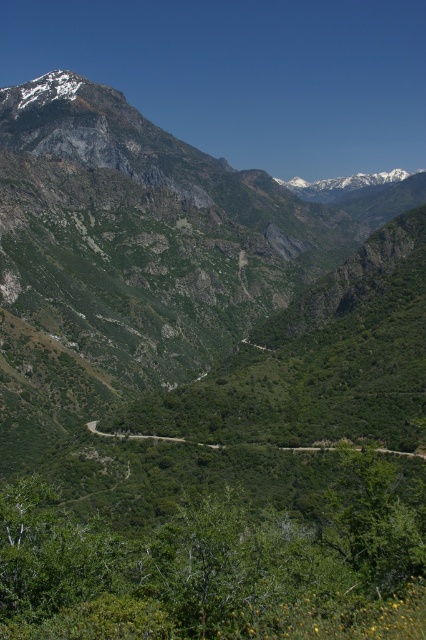
You are a hiker planning to take the green leafy road at center to reach the summit. Based on the image, will the green rocky mountain range at upper left block your path to the summit?

The green rocky mountain range at upper left is in front of the green leafy road at center, so it will block your path to the summit.

You are a hiker who wants to reach the green rocky mountain range at upper left from the green leafy road at center. Based on the provided information, what is the straight line distance you need to cover?

The straight line distance between the green rocky mountain range at upper left and the green leafy road at center is 124.31 meters.

You are a hiker planning to traverse the winding dirt road in the valley. You come across two points marked on your map at coordinates point (365, 310) and point (302, 445). Which point should you prioritize visiting first if you want to reach the snow capped peaks in the background?

Point (302, 445) should be prioritized first because it is closer to the snow capped peaks in the background than point (365, 310), which is behind it.